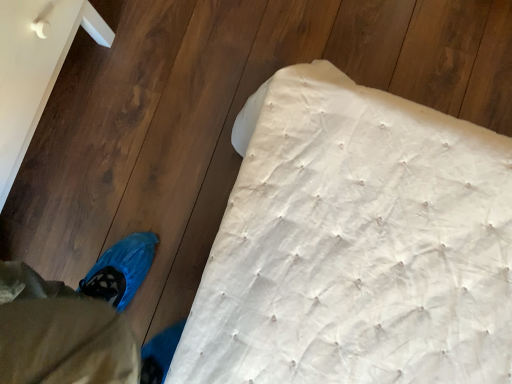
This screenshot has width=512, height=384. I want to click on vacant space to the right of blue fabric bag at lower left, so coord(186,94).